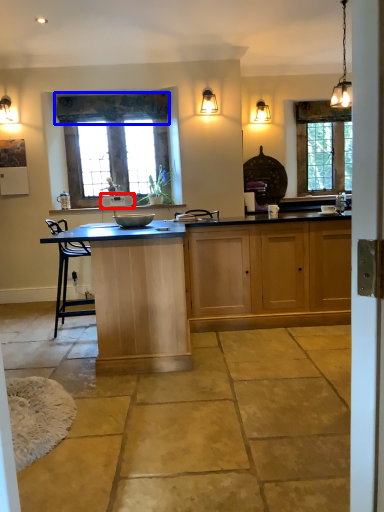
Question: Which point is further to the camera, appliance (highlighted by a red box) or curtain (highlighted by a blue box)?

Choices:
 (A) appliance
 (B) curtain

Answer: (A)